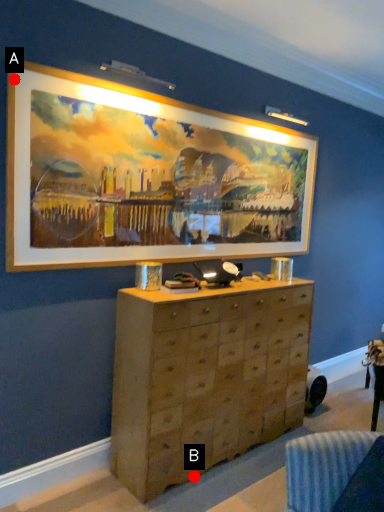
Question: Two points are circled on the image, labeled by A and B beside each circle. Among these points, which one is nearest to the camera?

Choices:
 (A) A is closer
 (B) B is closer

Answer: (A)